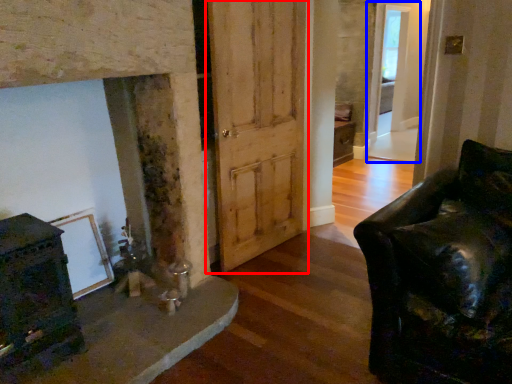
Question: Which object appears closest to the camera in this image, barn door (highlighted by a red box) or glass door (highlighted by a blue box)?

Choices:
 (A) barn door
 (B) glass door

Answer: (A)